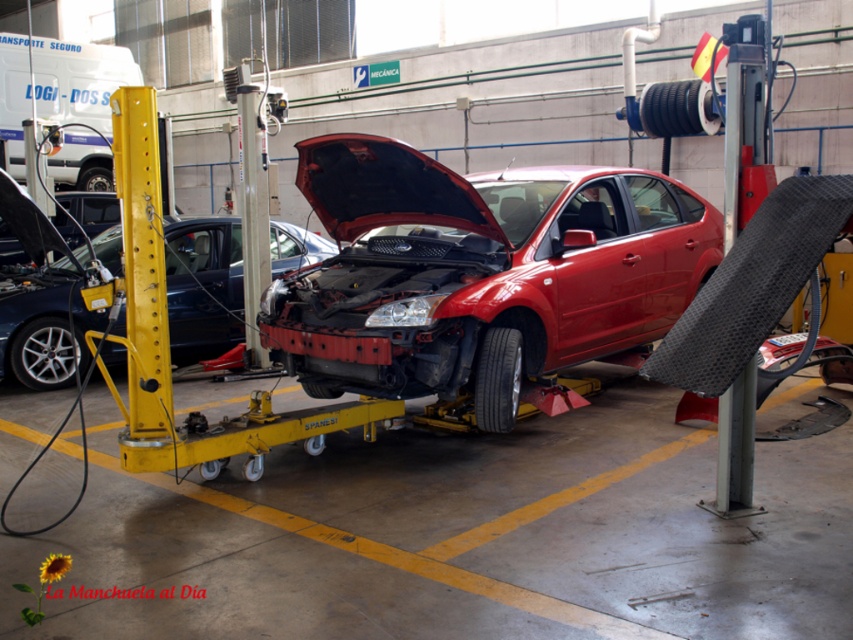
Based on the photo, what is located at the coordinate point (479, 273) in the image?

The shiny red car at center is located at the coordinate point (479, 273).

You are a mechanic working in the repair shop. You need to access the engine compartment of the red car on the lift. There are two points marked in the image. The first point is at coordinates point (518, 385), and the second point is at coordinates point (199, 308). Which point is closer to the engine compartment of the red car?

Point (518, 385) is in front of point (199, 308), so the first point is closer to the engine compartment of the red car.

You are an auto insurance adjuster assessing damage in a repair shop. You see the shiny red car at center and the shiny metallic car at center. Which car requires more space to park considering their sizes?

The shiny red car at center is larger in size than the shiny metallic car at center, so it requires more space to park.